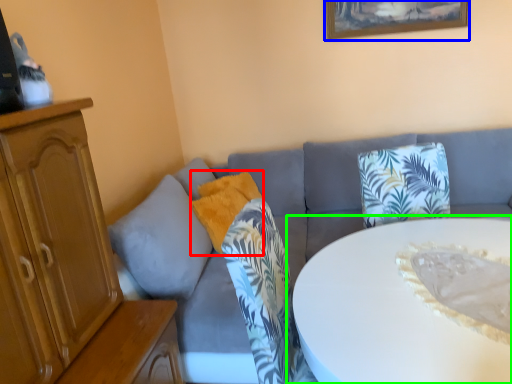
Question: Which object is positioned farthest from pillow (highlighted by a red box)? Select from picture frame (highlighted by a blue box) and table (highlighted by a green box).

Choices:
 (A) picture frame
 (B) table

Answer: (A)